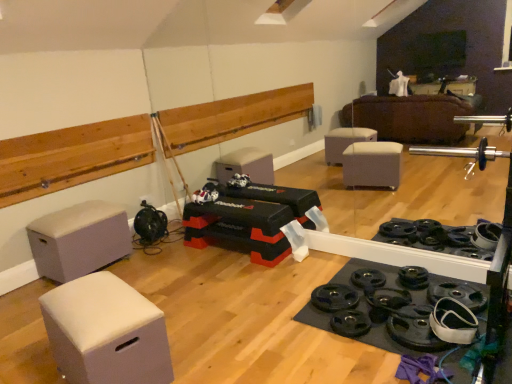
Locate an element on the screen. free space above white fabric ottoman at lower left, the 1th furniture in the front-to-back sequence (from a real-world perspective) is located at coordinates (88, 286).